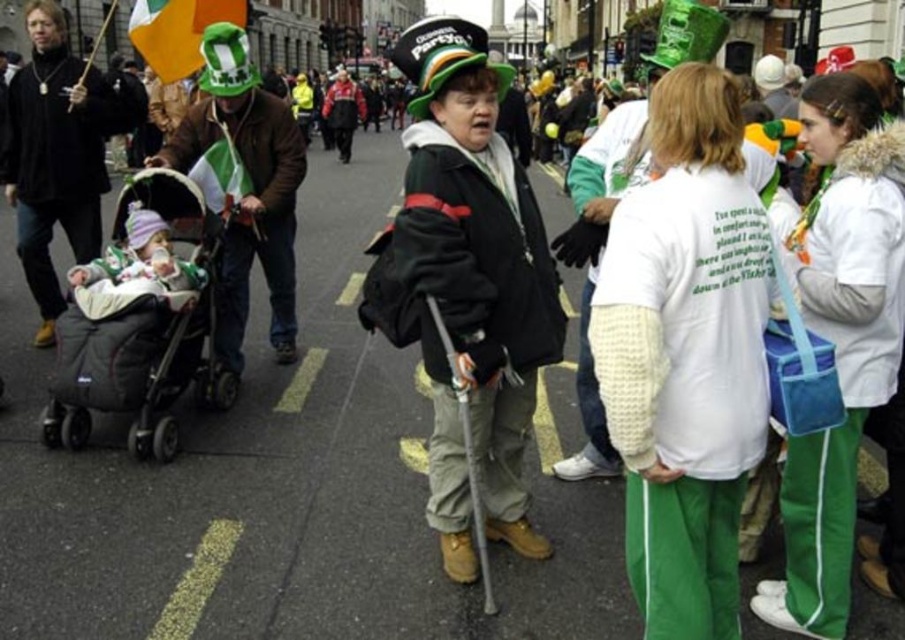
Question: Is white knitted sweater at center bigger than matte green hat at upper left?

Choices:
 (A) yes
 (B) no

Answer: (B)

Question: Does matte black jacket at center have a smaller size compared to soft green fabric baby carriage at left?

Choices:
 (A) yes
 (B) no

Answer: (B)

Question: Which of these objects is positioned farthest from the soft green fabric baby carriage at left?

Choices:
 (A) matte black jacket at center
 (B) shiny green hat at left
 (C) gray fabric stroller at left
 (D) matte green hat at upper left

Answer: (A)

Question: Which point is farther from the camera taking this photo?

Choices:
 (A) (719, 556)
 (B) (69, 368)
 (C) (212, 104)
 (D) (508, 403)

Answer: (C)

Question: Is green fleece jacket at right above shiny green hat at left?

Choices:
 (A) no
 (B) yes

Answer: (A)

Question: Which of the following is the closest to the observer?

Choices:
 (A) white knitted sweater at center
 (B) green fleece jacket at right

Answer: (A)